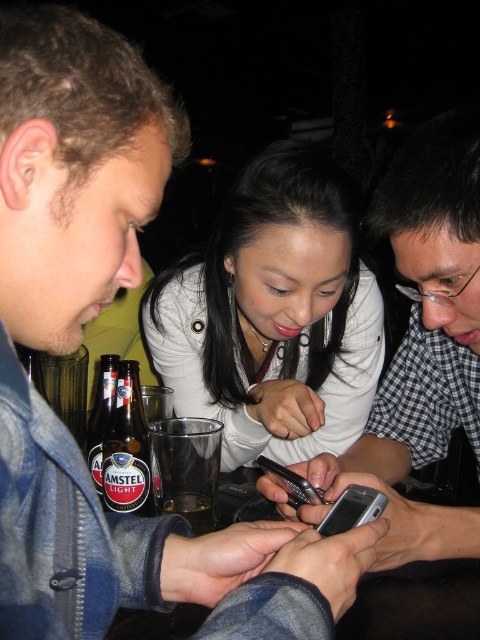
Is the position of silver metallic smartphone at lower center more distant than that of silver metallic smartphone at center?

→ No, silver metallic smartphone at lower center is in front of silver metallic smartphone at center.

Is silver metallic smartphone at lower center bigger than silver metallic smartphone at center?

No, silver metallic smartphone at lower center is not bigger than silver metallic smartphone at center.

Locate an element on the screen. silver metallic smartphone at lower center is located at coordinates (352, 509).

Which is above, amstel light glass bottle at center or amber glass beer at lower center?

amstel light glass bottle at center is above.

Locate an element on the screen. Image resolution: width=480 pixels, height=640 pixels. amstel light glass bottle at center is located at coordinates tap(127, 448).

Between amstel light glass bottle at center and amstel light glass bottle at lower left, which one is positioned higher?

amstel light glass bottle at lower left

Between amstel light glass bottle at center and amstel light glass bottle at lower left, which one has more height?

amstel light glass bottle at center

Who is more distant from viewer, (127, 467) or (103, 387)?

Positioned behind is point (103, 387).

Where is `amstel light glass bottle at center`? This screenshot has height=640, width=480. amstel light glass bottle at center is located at coordinates (127, 448).